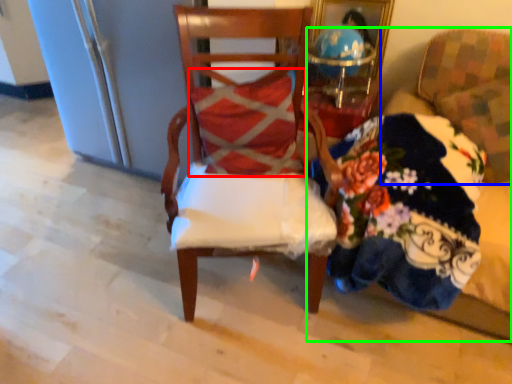
Question: Considering the real-world distances, which object is farthest from pillow (highlighted by a red box)? chair (highlighted by a blue box) or couch (highlighted by a green box)?

Choices:
 (A) chair
 (B) couch

Answer: (A)